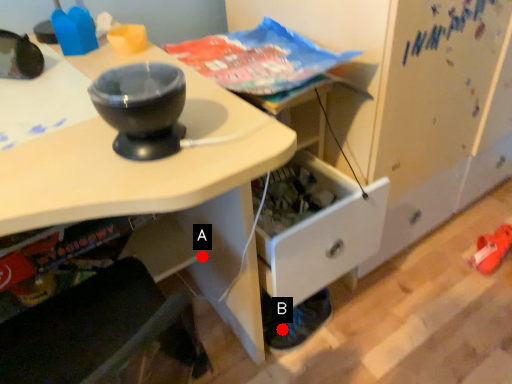
Question: Two points are circled on the image, labeled by A and B beside each circle. Among these points, which one is nearest to the camera?

Choices:
 (A) A is closer
 (B) B is closer

Answer: (A)